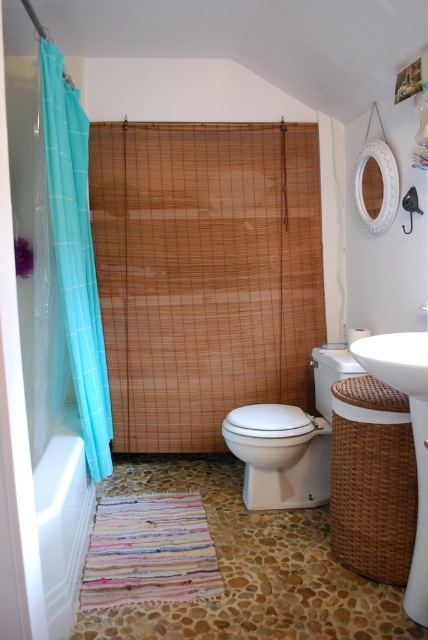
Question: Which is farther from the teal fabric shower curtain at left?

Choices:
 (A) bamboo curtain at center
 (B) white glossy towel at lower left
 (C) white ceramic sink at right
 (D) white glossy toilet at center

Answer: (C)

Question: Can you confirm if teal fabric shower curtain at left is positioned above white ceramic sink at right?

Choices:
 (A) no
 (B) yes

Answer: (B)

Question: Does bamboo curtain at center come in front of white ceramic sink at right?

Choices:
 (A) no
 (B) yes

Answer: (A)

Question: Among these points, which one is farthest from the camera?

Choices:
 (A) (26, 560)
 (B) (306, 417)
 (C) (228, 236)

Answer: (C)

Question: Which object is positioned farthest from the transparent plastic screen door at left?

Choices:
 (A) white glossy towel at lower left
 (B) teal fabric shower curtain at left

Answer: (B)

Question: Can you confirm if bamboo curtain at center is positioned below white glossy toilet at center?

Choices:
 (A) yes
 (B) no

Answer: (B)